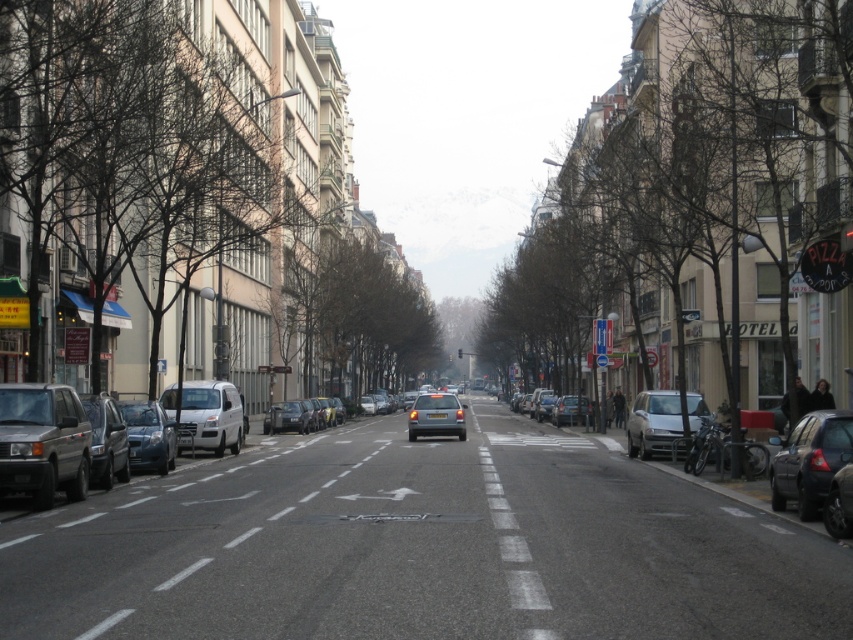
Question: Among these points, which one is farthest from the camera?

Choices:
 (A) (675, 442)
 (B) (202, 440)
 (C) (833, 422)
 (D) (428, 396)

Answer: (D)

Question: Does matte black car at left have a smaller size compared to matte silver car at center?

Choices:
 (A) no
 (B) yes

Answer: (B)

Question: Which point is closer to the camera taking this photo?

Choices:
 (A) (297, 428)
 (B) (798, 486)

Answer: (B)

Question: Is dark gray matte car at right positioned in front of white matte van at center?

Choices:
 (A) no
 (B) yes

Answer: (B)

Question: Which point is closer to the camera?

Choices:
 (A) (218, 392)
 (B) (129, 472)

Answer: (B)

Question: Can you confirm if white matte van at center is wider than matte silver car at center?

Choices:
 (A) no
 (B) yes

Answer: (A)